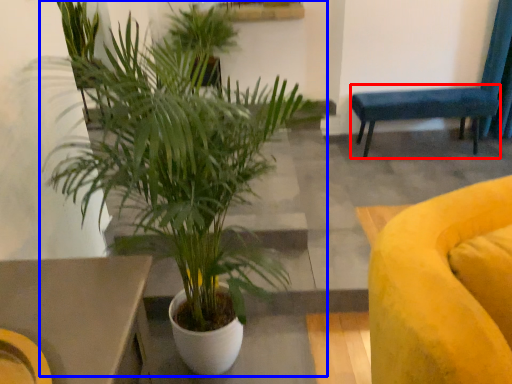
Question: Which object appears closest to the camera in this image, armchair (highlighted by a red box) or houseplant (highlighted by a blue box)?

Choices:
 (A) armchair
 (B) houseplant

Answer: (B)